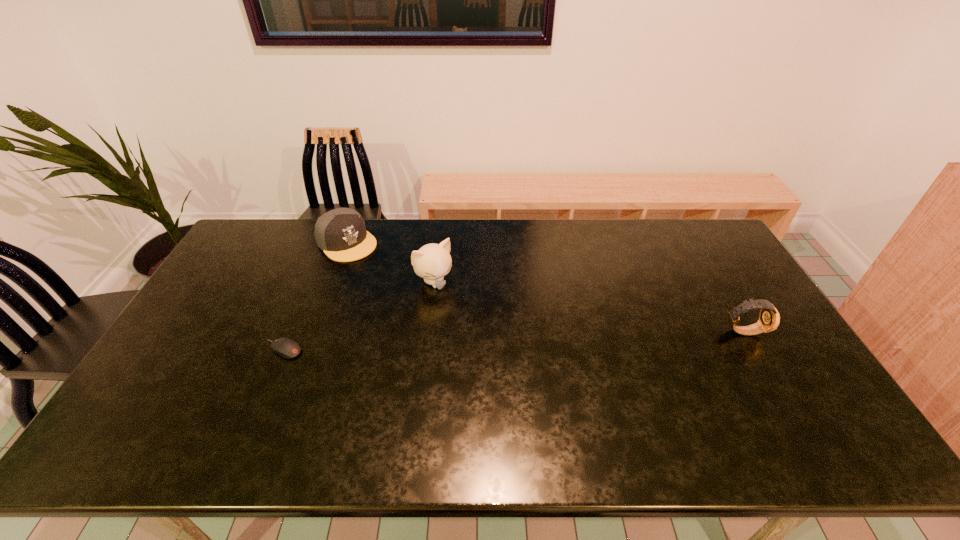
What are the coordinates of `vacant space located 0.200m on the front-facing side of the cap` in the screenshot? It's located at (395, 287).

This screenshot has width=960, height=540. In order to click on free location located 0.220m on the front-facing side of the cap in this screenshot , I will do `click(397, 290)`.

Image resolution: width=960 pixels, height=540 pixels. Identify the location of free point located 0.240m on the front-facing side of the cap. (401, 293).

I want to click on object that is at the far edge, so click(341, 233).

Locate an element on the screen. The width and height of the screenshot is (960, 540). object that is at the right edge is located at coordinates (769, 319).

Image resolution: width=960 pixels, height=540 pixels. Find the location of `free space at the far edge of the desktop`. free space at the far edge of the desktop is located at coordinates (x=470, y=225).

Image resolution: width=960 pixels, height=540 pixels. I want to click on vacant space at the near edge of the desktop, so click(624, 409).

Where is `vacant space at the left edge of the desktop`? This screenshot has width=960, height=540. vacant space at the left edge of the desktop is located at coordinates (246, 299).

The image size is (960, 540). Find the location of `vacant space at the right edge`. vacant space at the right edge is located at coordinates (725, 262).

This screenshot has width=960, height=540. In order to click on vacant space at the near left corner of the desktop in this screenshot , I will do `click(158, 394)`.